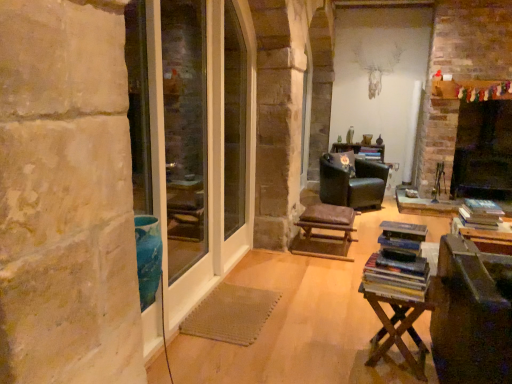
Question: Can you confirm if wooden table at lower right is thinner than black leather chair at center?

Choices:
 (A) yes
 (B) no

Answer: (A)

Question: Is the depth of wooden table at lower right greater than that of black leather chair at center?

Choices:
 (A) no
 (B) yes

Answer: (A)

Question: Can you confirm if wooden table at lower right is bigger than black leather chair at center?

Choices:
 (A) yes
 (B) no

Answer: (B)

Question: Is black leather chair at center at the back of wooden table at lower right?

Choices:
 (A) yes
 (B) no

Answer: (B)

Question: From the image's perspective, would you say wooden table at lower right is shown under black leather chair at center?

Choices:
 (A) no
 (B) yes

Answer: (B)

Question: Is wooden table at lower right taller than black leather chair at center?

Choices:
 (A) yes
 (B) no

Answer: (B)

Question: From the image's perspective, does black matte fireplace at right appear lower than clear glass door at left, the first screen door viewed from the left?

Choices:
 (A) no
 (B) yes

Answer: (A)

Question: Does black matte fireplace at right have a lesser height compared to clear glass door at left, the first screen door viewed from the left?

Choices:
 (A) yes
 (B) no

Answer: (A)

Question: Is the surface of black matte fireplace at right in direct contact with clear glass door at left, the first screen door viewed from the left?

Choices:
 (A) yes
 (B) no

Answer: (B)

Question: Is the depth of black matte fireplace at right less than that of clear glass door at left, the first screen door viewed from the left?

Choices:
 (A) yes
 (B) no

Answer: (B)

Question: Is black matte fireplace at right wider than clear glass door at left, the second screen door when ordered from right to left?

Choices:
 (A) yes
 (B) no

Answer: (A)

Question: Is black matte fireplace at right thinner than clear glass door at left, the first screen door viewed from the left?

Choices:
 (A) no
 (B) yes

Answer: (A)

Question: Is wooden table at lower right aimed at clear glass door at left, the first screen door viewed from the left?

Choices:
 (A) yes
 (B) no

Answer: (B)